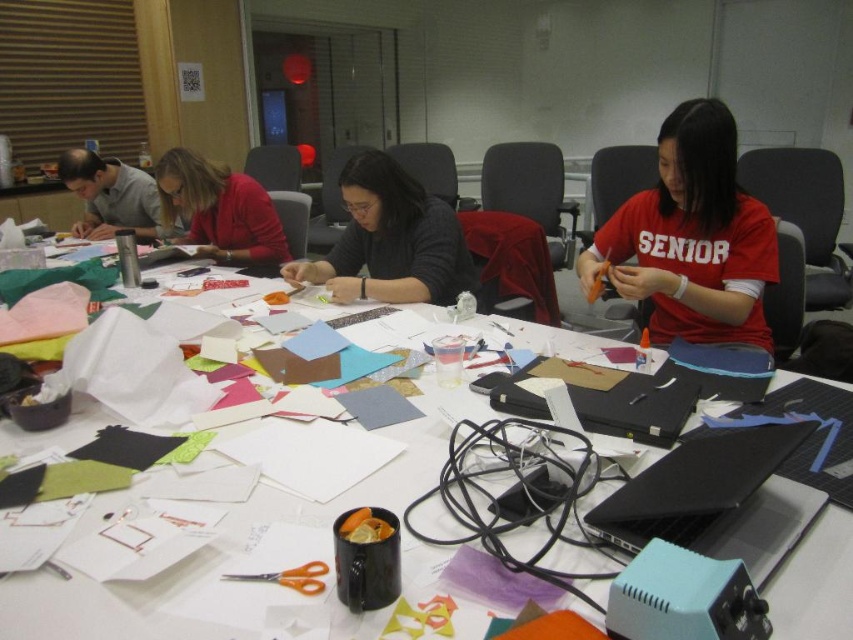
Who is lower down, white paper at center or red matte shirt at center?

Positioned lower is white paper at center.

Which is in front, point (86, 616) or point (726, 259)?

Point (86, 616) is in front.

The width and height of the screenshot is (853, 640). I want to click on white paper at center, so click(x=102, y=605).

Who is lower down, red matte shirt at center or black plastic laptop at lower right?

black plastic laptop at lower right is below.

Who is more distant from viewer, (721, 307) or (701, 464)?

The point (721, 307) is more distant.

Identify the location of red matte shirt at center. pyautogui.click(x=692, y=237).

Is black plastic laptop at lower right below matte gray shirt at upper left?

Yes, black plastic laptop at lower right is below matte gray shirt at upper left.

From the picture: Can you confirm if black plastic laptop at lower right is taller than matte gray shirt at upper left?

In fact, black plastic laptop at lower right may be shorter than matte gray shirt at upper left.

Describe the element at coordinates (717, 499) in the screenshot. The width and height of the screenshot is (853, 640). I see `black plastic laptop at lower right` at that location.

Where is `black plastic laptop at lower right`? This screenshot has height=640, width=853. black plastic laptop at lower right is located at coordinates (717, 499).